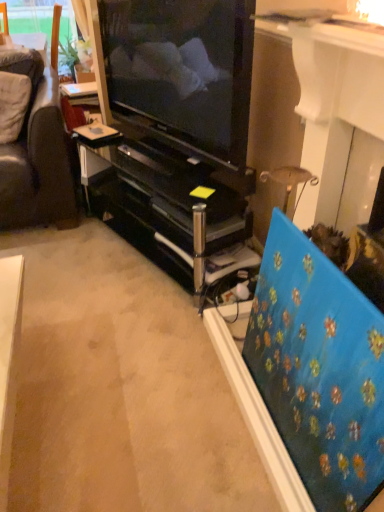
This screenshot has width=384, height=512. I want to click on blank space to the left of blue textured canvas at right, so click(x=176, y=434).